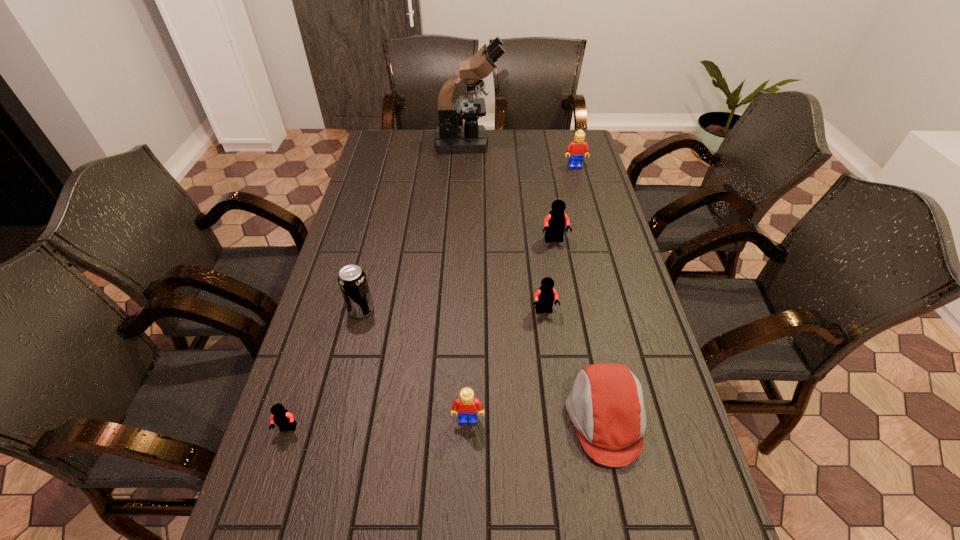
In the image, there is a desktop. At what (x,y) coordinates should I click in order to perform the action: click on vacant region at the right edge. Please return your answer as a coordinate pair (x, y). Looking at the image, I should click on (707, 537).

The image size is (960, 540). What are the coordinates of `vacant space at the far left corner of the desktop` in the screenshot? It's located at (396, 148).

Where is `free space at the far right corner of the desktop`? free space at the far right corner of the desktop is located at coordinates (553, 144).

Locate an element on the screen. This screenshot has width=960, height=540. free space between the soda can and the third nearest Lego is located at coordinates (453, 310).

Identify the location of free space between the third nearest Lego and the fourth nearest Lego. The height and width of the screenshot is (540, 960). pos(549,276).

Where is `blank region between the sixth nearest object and the second biggest black Lego`? The image size is (960, 540). blank region between the sixth nearest object and the second biggest black Lego is located at coordinates (549, 276).

This screenshot has width=960, height=540. I want to click on vacant space that's between the sixth nearest object and the fourth Lego from right to left, so click(512, 329).

Locate an element on the screen. The image size is (960, 540). free spot between the soda can and the cap is located at coordinates (483, 364).

At what (x,y) coordinates should I click in order to perform the action: click on vacant space that is in between the microscope and the second farthest object. Please return your answer as a coordinate pair (x, y). The image size is (960, 540). Looking at the image, I should click on (521, 155).

Find the location of a particular element. free space between the farther yellow Lego and the soda can is located at coordinates pyautogui.click(x=468, y=238).